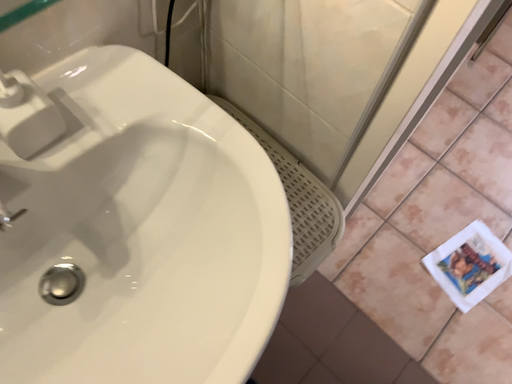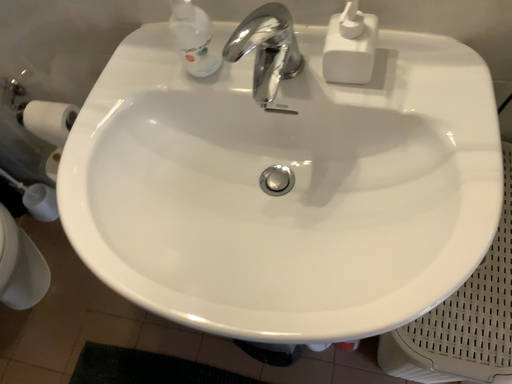
Question: How did the camera likely rotate when shooting the video?

Choices:
 (A) rotated downward
 (B) rotated upward

Answer: (B)